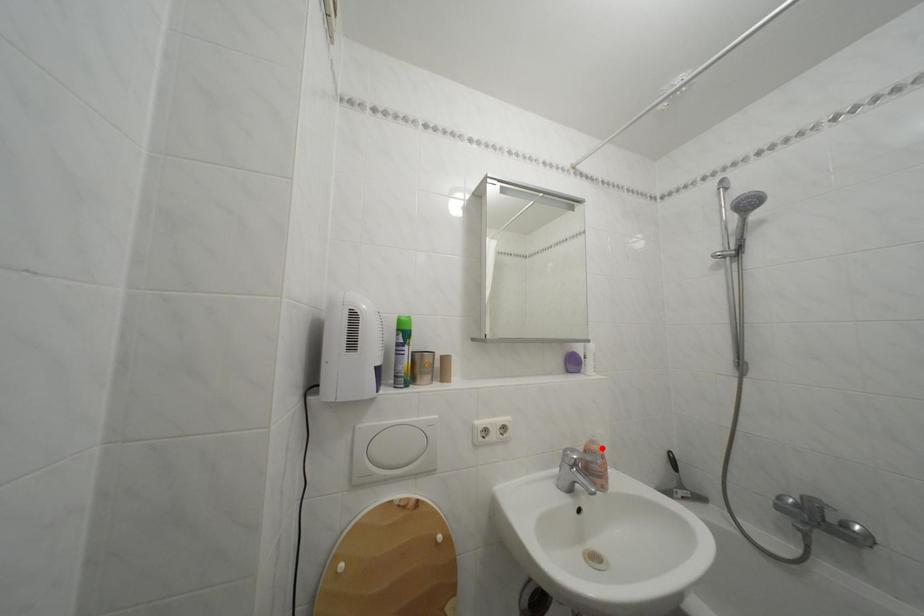
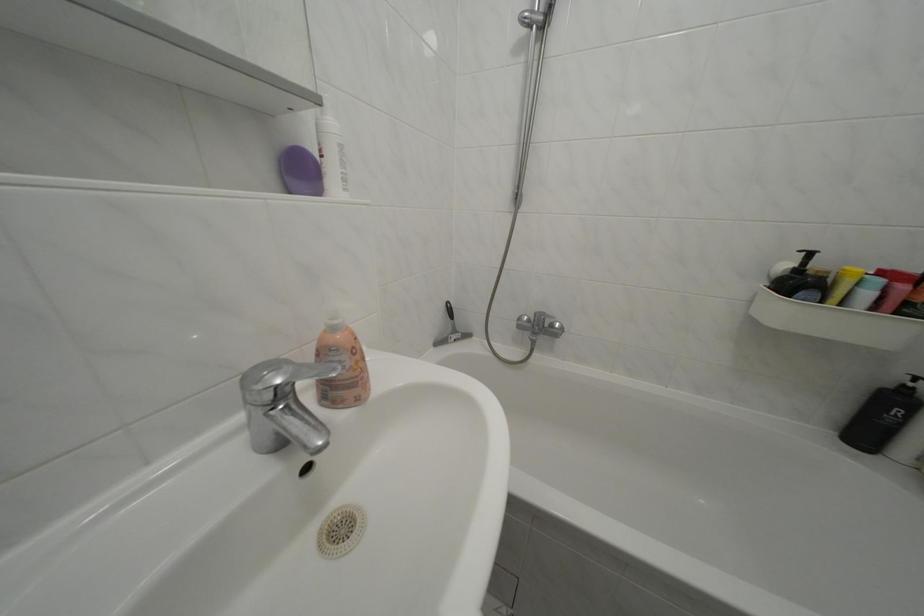
Where in the second image is the point corresponding to the highlighted location from the first image?

(342, 334)